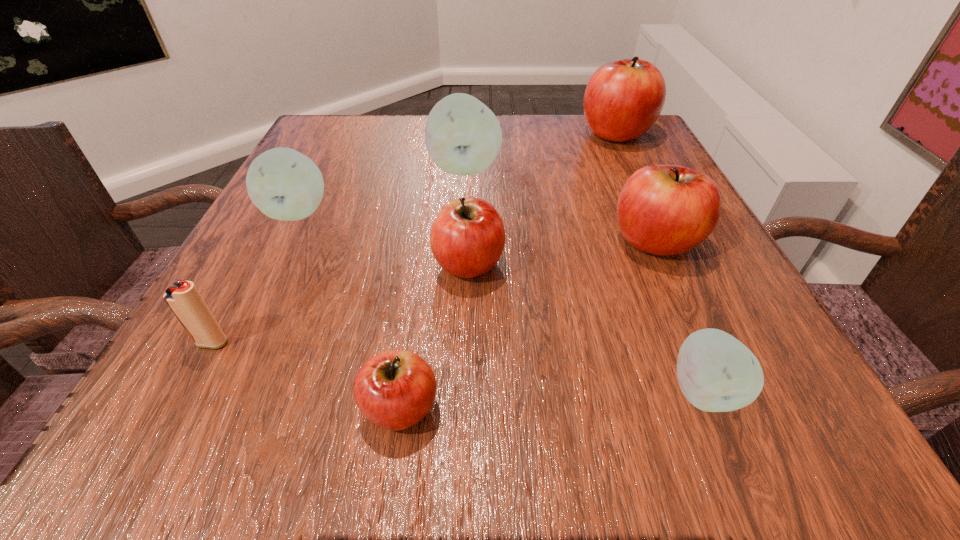
Identify the location of apple present at the left edge. The width and height of the screenshot is (960, 540). (284, 184).

The height and width of the screenshot is (540, 960). Find the location of `igniter that is at the left edge`. igniter that is at the left edge is located at coordinates (183, 298).

I want to click on object located at the far right corner, so click(623, 99).

Find the location of a particular element. The height and width of the screenshot is (540, 960). object at the near right corner is located at coordinates (716, 372).

In the image, there is a desktop. At what (x,y) coordinates should I click in order to perform the action: click on vacant space at the far edge. Please return your answer as a coordinate pair (x, y). Looking at the image, I should click on click(x=428, y=159).

At what (x,y) coordinates should I click in order to perform the action: click on vacant position at the near edge of the desktop. Please return your answer as a coordinate pair (x, y). This screenshot has height=540, width=960. Looking at the image, I should click on (596, 453).

At what (x,y) coordinates should I click in order to perform the action: click on vacant space at the left edge. Please return your answer as a coordinate pair (x, y). Looking at the image, I should click on (335, 210).

Where is `vacant region at the right edge`? vacant region at the right edge is located at coordinates (629, 267).

Locate an element on the screen. The width and height of the screenshot is (960, 540). vacant area at the far left corner of the desktop is located at coordinates (330, 138).

Image resolution: width=960 pixels, height=540 pixels. In order to click on free spot at the far right corner of the desktop in this screenshot , I will do `click(662, 156)`.